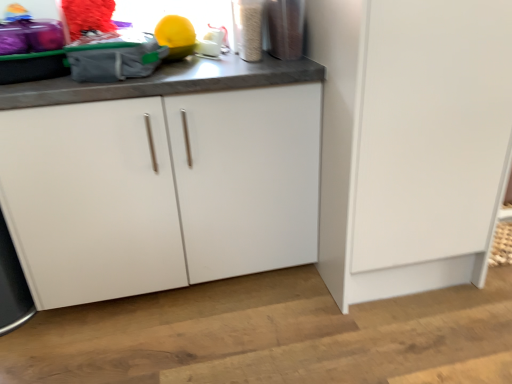
Question: Does white matte cabinet door at lower right have a greater width compared to metallic silver container at upper right, positioned as the second appliance in left-to-right order?

Choices:
 (A) no
 (B) yes

Answer: (B)

Question: Considering the relative sizes of white matte cabinet door at lower right and metallic silver container at upper right, placed as the first appliance when sorted from right to left, in the image provided, is white matte cabinet door at lower right shorter than metallic silver container at upper right, placed as the first appliance when sorted from right to left,?

Choices:
 (A) yes
 (B) no

Answer: (B)

Question: Is white matte cabinet door at lower right to the left of metallic silver container at upper right, positioned as the second appliance in left-to-right order, from the viewer's perspective?

Choices:
 (A) no
 (B) yes

Answer: (A)

Question: From a real-world perspective, does white matte cabinet door at lower right sit lower than metallic silver container at upper right, placed as the first appliance when sorted from right to left?

Choices:
 (A) yes
 (B) no

Answer: (A)

Question: Is white matte cabinet door at lower right at the right side of metallic silver container at upper right, placed as the first appliance when sorted from right to left?

Choices:
 (A) no
 (B) yes

Answer: (B)

Question: From a real-world perspective, relative to metallic silver container at upper right, positioned as the second appliance in left-to-right order, is metallic silver canister at upper right, positioned as the second appliance in right-to-left order, vertically above or below?

Choices:
 (A) above
 (B) below

Answer: (A)

Question: Visually, is metallic silver canister at upper right, the 1th appliance in the left-to-right sequence, positioned to the left or to the right of metallic silver container at upper right, placed as the first appliance when sorted from right to left?

Choices:
 (A) left
 (B) right

Answer: (A)

Question: Is point (248, 41) closer or farther from the camera than point (266, 13)?

Choices:
 (A) closer
 (B) farther

Answer: (A)

Question: From their relative heights in the image, would you say metallic silver canister at upper right, positioned as the second appliance in right-to-left order, is taller or shorter than metallic silver container at upper right, positioned as the second appliance in left-to-right order?

Choices:
 (A) tall
 (B) short

Answer: (A)

Question: Considering the positions of point (291, 44) and point (244, 8), is point (291, 44) closer or farther from the camera than point (244, 8)?

Choices:
 (A) closer
 (B) farther

Answer: (A)

Question: Is metallic silver container at upper right, placed as the first appliance when sorted from right to left, inside or outside of metallic silver canister at upper right, the 1th appliance in the left-to-right sequence?

Choices:
 (A) outside
 (B) inside

Answer: (A)

Question: Is metallic silver container at upper right, positioned as the second appliance in left-to-right order, to the left or to the right of metallic silver canister at upper right, the 1th appliance in the left-to-right sequence, in the image?

Choices:
 (A) left
 (B) right

Answer: (B)

Question: In the image, is metallic silver container at upper right, positioned as the second appliance in left-to-right order, positioned in front of or behind metallic silver canister at upper right, the 1th appliance in the left-to-right sequence?

Choices:
 (A) front
 (B) behind

Answer: (B)

Question: In the image, is metallic silver canister at upper right, the 1th appliance in the left-to-right sequence, on the left side or the right side of white matte cabinet door at lower right?

Choices:
 (A) left
 (B) right

Answer: (A)

Question: From their relative heights in the image, would you say metallic silver canister at upper right, the 1th appliance in the left-to-right sequence, is taller or shorter than white matte cabinet door at lower right?

Choices:
 (A) short
 (B) tall

Answer: (A)